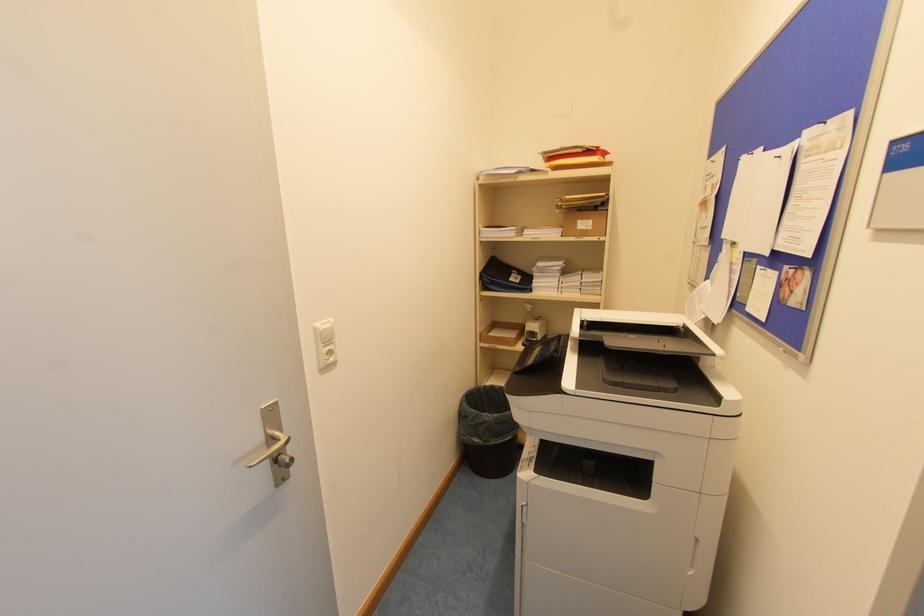
Find where to lift the printer scanner lid. Please return your answer as a coordinate pair (x, y).

(647, 362)